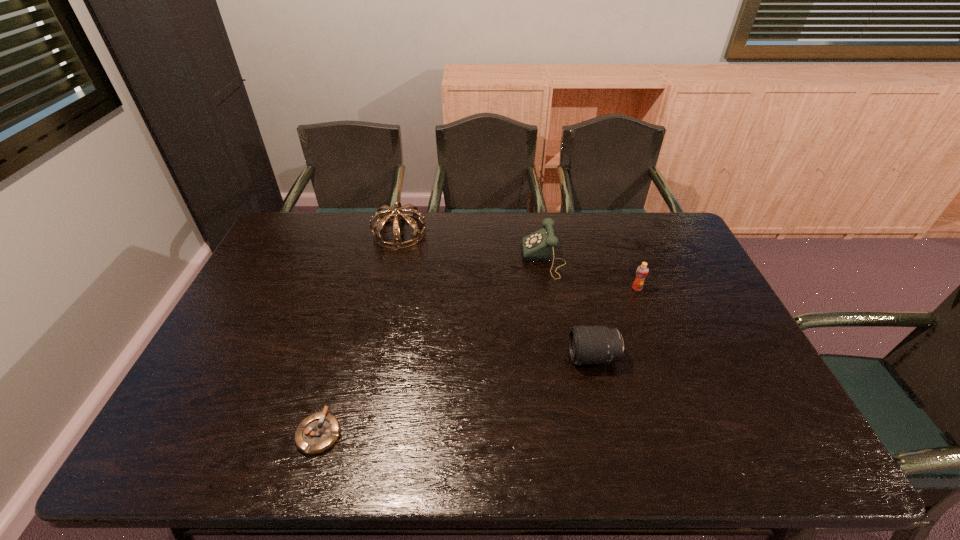
The height and width of the screenshot is (540, 960). I want to click on vacant position located 0.150m on the dial of the telephone, so pyautogui.click(x=478, y=259).

This screenshot has width=960, height=540. I want to click on vacant space located on the dial of the telephone, so click(x=445, y=259).

Find the location of a particular element. vacant region located on the surface of the telephoto lens is located at coordinates (420, 357).

You are a GUI agent. You are given a task and a screenshot of the screen. Output one action in this format:
    pyautogui.click(x=<x>, y=<y>)
    Task: Click on the free region located 0.300m on the surface of the telephoto lens
    The image size is (960, 540).
    Given the screenshot: What is the action you would take?
    pyautogui.click(x=457, y=357)

Locate an element on the screen. This screenshot has height=540, width=960. free space located 0.140m on the surface of the telephoto lens is located at coordinates (517, 357).

Where is `vacant space located 0.280m on the back of the shortest object`? Image resolution: width=960 pixels, height=540 pixels. vacant space located 0.280m on the back of the shortest object is located at coordinates (350, 324).

The image size is (960, 540). Identify the location of tiara that is at the far edge. pyautogui.click(x=413, y=219).

Where is `telephone at the far edge`? This screenshot has height=540, width=960. telephone at the far edge is located at coordinates (539, 246).

Identify the location of object present at the near edge. The height and width of the screenshot is (540, 960). (317, 433).

The image size is (960, 540). Find the location of `free space at the far edge of the desktop`. free space at the far edge of the desktop is located at coordinates (579, 234).